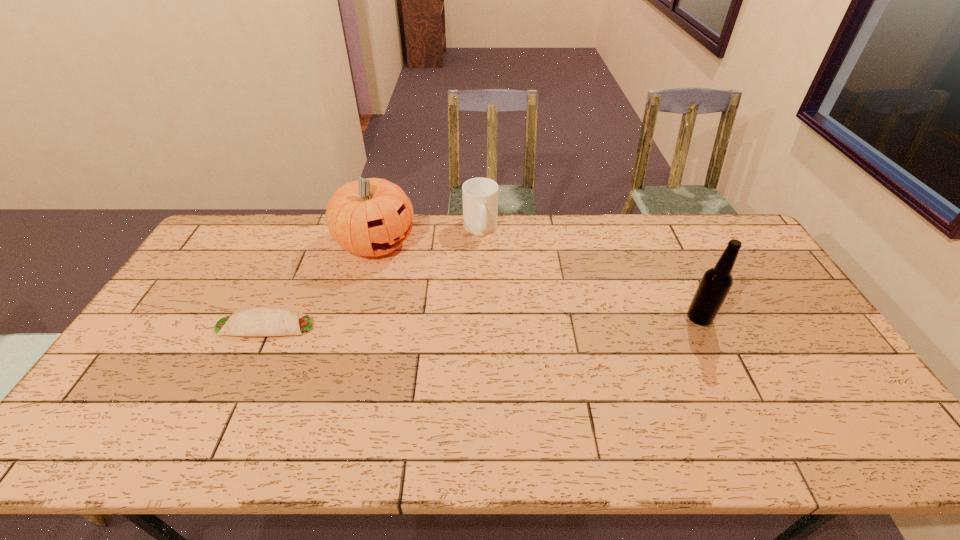
This screenshot has width=960, height=540. Identify the location of free space on the desktop that is between the shortest object and the beer bottle and is positioned on the front-facing side of the pumpkin. (492, 322).

Locate an element on the screen. free space on the desktop that is between the shortest object and the beer bottle and is positioned on the handle side of the second shortest object is located at coordinates point(524,321).